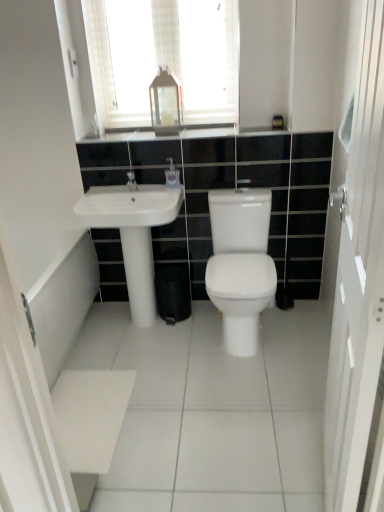
Question: Looking at their shapes, would you say transparent glass lantern at upper center is wider or thinner than white glossy soap dispenser at center?

Choices:
 (A) wide
 (B) thin

Answer: (A)

Question: From the image's perspective, relative to white glossy soap dispenser at center, is transparent glass lantern at upper center above or below?

Choices:
 (A) above
 (B) below

Answer: (A)

Question: Which object is the farthest from the white glossy screen door at right?

Choices:
 (A) transparent glass lantern at upper center
 (B) matte silver faucet at center
 (C) white glossy countertop at upper center
 (D) white glossy soap dispenser at center
 (E) white glossy sink at left

Answer: (A)

Question: Which is nearer to the white glossy sink at left?

Choices:
 (A) white glossy soap dispenser at center
 (B) transparent glass lantern at upper center
 (C) matte silver faucet at center
 (D) white glossy pedestal at center
 (E) white glossy screen door at right

Answer: (C)